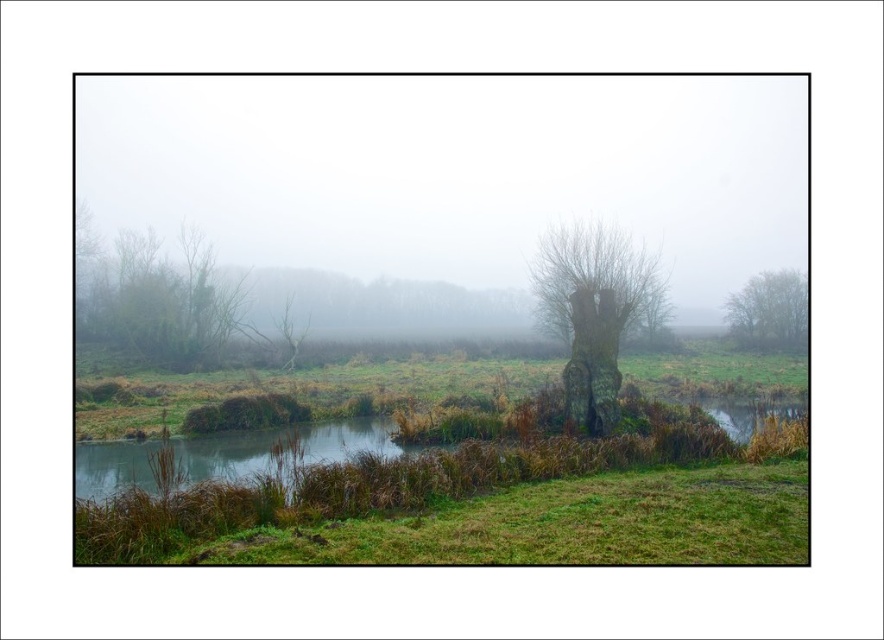
Question: Which is nearer to the green matte tree at right?

Choices:
 (A) green mossy tree trunk at center
 (B) green matte tree at left

Answer: (A)

Question: Which point is closer to the camera taking this photo?

Choices:
 (A) (278, 336)
 (B) (629, 243)
 (C) (340, 176)

Answer: (B)

Question: Among these points, which one is farthest from the camera?

Choices:
 (A) (286, 305)
 (B) (631, 220)

Answer: (B)

Question: Observing the image, what is the correct spatial positioning of foggy misty atmosphere at center in reference to green matte tree at left?

Choices:
 (A) right
 (B) left

Answer: (A)

Question: Does green mossy tree trunk at center have a greater width compared to bare branches at center?

Choices:
 (A) no
 (B) yes

Answer: (B)

Question: Does foggy misty atmosphere at center appear on the left side of green matte tree at left?

Choices:
 (A) no
 (B) yes

Answer: (A)